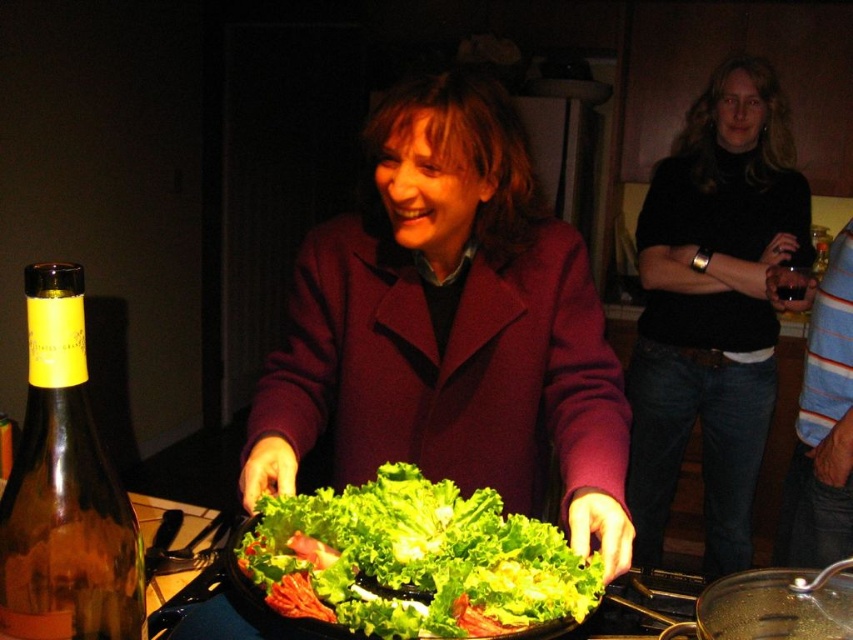
From the picture: You are a guest at the event and want to place a rectangular gift box that is 1 meter wide on the available space between the matte purple coat at center and the transparent glass wok at lower right. Can the gift box fit there?

The matte purple coat at center is wider than the transparent glass wok at lower right, so the space between them may not be wide enough to accommodate a 1 meter wide gift box. Check the actual dimensions before placing it.

You are planning to place a small decorative item on the matte purple coat at center. Considering the size of the transparent glass wok at lower right, will the coat be able to support the item without it falling off?

The matte purple coat at center has a larger size compared to transparent glass wok at lower right. Since the coat is bigger, it can likely support the small decorative item without it falling off.